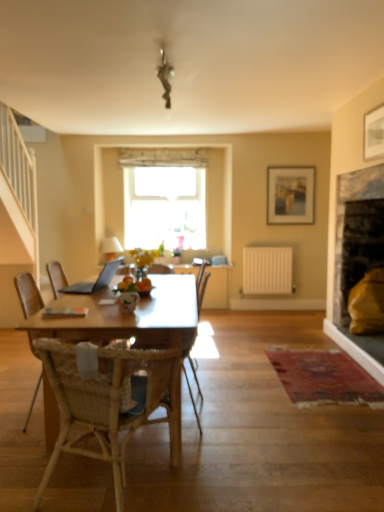
Where is `free spot to the right of woven wood chair at center, the 3th chair when ordered from front to back`? free spot to the right of woven wood chair at center, the 3th chair when ordered from front to back is located at coordinates (252, 416).